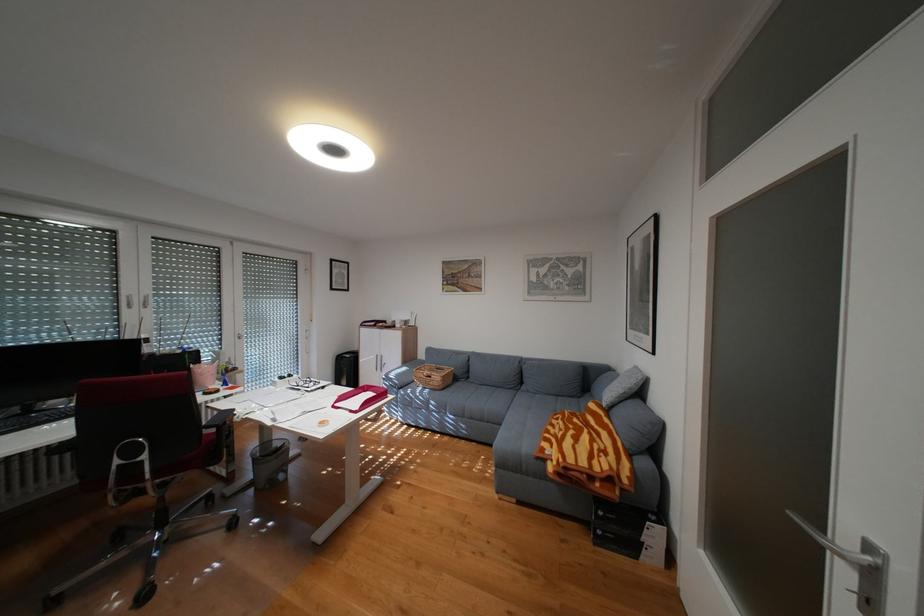
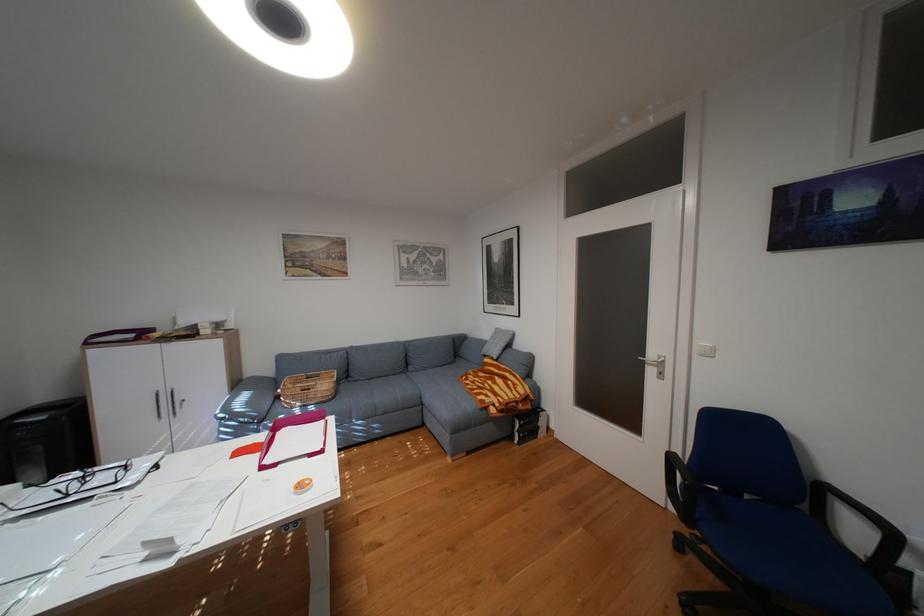
Find the pixel in the second image that matches (393,363) in the first image.

(180, 403)